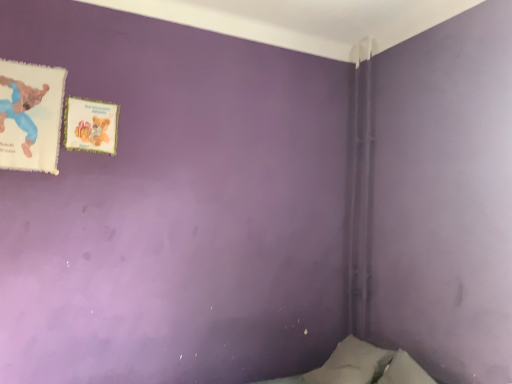
You are a GUI agent. You are given a task and a screenshot of the screen. Output one action in this format:
    pyautogui.click(x=<x>, y=<y>)
    Task: Click on the matte paper book at upper left, which appears as the first paperback book when viewed from the front
    This screenshot has height=384, width=512.
    Given the screenshot: What is the action you would take?
    pyautogui.click(x=30, y=116)

This screenshot has height=384, width=512. Describe the element at coordinates (30, 116) in the screenshot. I see `matte paper book at upper left, the 2th paperback book from the back` at that location.

What is the approximate width of matte paper book at upper left, marked as the second paperback book in a right-to-left arrangement?

1.09 inches.

Image resolution: width=512 pixels, height=384 pixels. What do you see at coordinates (90, 125) in the screenshot?
I see `matte paper book at upper left, which ranks as the 1th paperback book in right-to-left order` at bounding box center [90, 125].

This screenshot has height=384, width=512. I want to click on matte paper book at upper left, which appears as the 1th paperback book when viewed from the back, so click(x=90, y=125).

What is the approximate width of matte paper book at upper left, acting as the second paperback book starting from the left?

It is 0.63 inches.

Locate an element on the screen. The width and height of the screenshot is (512, 384). matte paper book at upper left, which is counted as the first paperback book, starting from the left is located at coordinates (30, 116).

Considering the positions of objects matte paper book at upper left, acting as the second paperback book starting from the left, and matte paper book at upper left, marked as the second paperback book in a right-to-left arrangement, in the image provided, who is more to the right, matte paper book at upper left, acting as the second paperback book starting from the left, or matte paper book at upper left, marked as the second paperback book in a right-to-left arrangement,?

matte paper book at upper left, acting as the second paperback book starting from the left.

Based on the photo, who is more distant, matte paper book at upper left, which appears as the 1th paperback book when viewed from the back, or matte paper book at upper left, which is counted as the first paperback book, starting from the left?

Positioned behind is matte paper book at upper left, which appears as the 1th paperback book when viewed from the back.

Is point (89, 144) positioned in front of point (64, 85)?

No, (89, 144) is further to viewer.

From the image's perspective, which object appears higher, matte paper book at upper left, acting as the second paperback book starting from the left, or matte paper book at upper left, the 2th paperback book from the back?

matte paper book at upper left, the 2th paperback book from the back, from the image's perspective.

From a real-world perspective, is matte paper book at upper left, the second paperback book from the front, physically located above or below matte paper book at upper left, the 2th paperback book from the back?

matte paper book at upper left, the second paperback book from the front, is above matte paper book at upper left, the 2th paperback book from the back.

In the scene shown: Which of these two, matte paper book at upper left, the second paperback book from the front, or matte paper book at upper left, which is counted as the first paperback book, starting from the left, is wider?

matte paper book at upper left, which is counted as the first paperback book, starting from the left.

Who is shorter, matte paper book at upper left, the second paperback book from the front, or matte paper book at upper left, the 2th paperback book from the back?

matte paper book at upper left, the second paperback book from the front.

Who is bigger, matte paper book at upper left, which appears as the 1th paperback book when viewed from the back, or matte paper book at upper left, the 2th paperback book from the back?

matte paper book at upper left, the 2th paperback book from the back, is bigger.

Could matte paper book at upper left, which appears as the first paperback book when viewed from the front, be considered to be inside matte paper book at upper left, acting as the second paperback book starting from the left?

No, matte paper book at upper left, acting as the second paperback book starting from the left, does not contain matte paper book at upper left, which appears as the first paperback book when viewed from the front.

Is matte paper book at upper left, acting as the second paperback book starting from the left, next to matte paper book at upper left, which is counted as the first paperback book, starting from the left?

No.

Is matte paper book at upper left, acting as the second paperback book starting from the left, positioned with its back to matte paper book at upper left, which appears as the first paperback book when viewed from the front?

That's not correct — matte paper book at upper left, acting as the second paperback book starting from the left, is not looking away from matte paper book at upper left, which appears as the first paperback book when viewed from the front.

How far apart are matte paper book at upper left, the second paperback book from the front, and matte paper book at upper left, which is counted as the first paperback book, starting from the left?

matte paper book at upper left, the second paperback book from the front, and matte paper book at upper left, which is counted as the first paperback book, starting from the left, are 6.82 inches apart.

Where is `paperback book below the matte paper book at upper left, which is counted as the first paperback book, starting from the left (from the image's perspective)`? The image size is (512, 384). paperback book below the matte paper book at upper left, which is counted as the first paperback book, starting from the left (from the image's perspective) is located at coordinates (90, 125).

Which is more to the right, matte paper book at upper left, the 2th paperback book from the back, or matte paper book at upper left, which ranks as the 1th paperback book in right-to-left order?

Positioned to the right is matte paper book at upper left, which ranks as the 1th paperback book in right-to-left order.

Which object is further away from the camera taking this photo, matte paper book at upper left, which is counted as the first paperback book, starting from the left, or matte paper book at upper left, which ranks as the 1th paperback book in right-to-left order?

matte paper book at upper left, which ranks as the 1th paperback book in right-to-left order, is more distant.

Considering the positions of point (11, 146) and point (101, 122), is point (11, 146) closer or farther from the camera than point (101, 122)?

Point (11, 146) is closer to the camera than point (101, 122).

From the image's perspective, is matte paper book at upper left, the 2th paperback book from the back, beneath matte paper book at upper left, the second paperback book from the front?

No, from the image's perspective, matte paper book at upper left, the 2th paperback book from the back, is not beneath matte paper book at upper left, the second paperback book from the front.

From a real-world perspective, between matte paper book at upper left, the 2th paperback book from the back, and matte paper book at upper left, the second paperback book from the front, who is vertically lower?

In real-world perspective, matte paper book at upper left, the 2th paperback book from the back, is lower.

Considering the sizes of objects matte paper book at upper left, which appears as the first paperback book when viewed from the front, and matte paper book at upper left, the second paperback book from the front, in the image provided, who is thinner, matte paper book at upper left, which appears as the first paperback book when viewed from the front, or matte paper book at upper left, the second paperback book from the front,?

With smaller width is matte paper book at upper left, the second paperback book from the front.

Considering the sizes of matte paper book at upper left, marked as the second paperback book in a right-to-left arrangement, and matte paper book at upper left, which ranks as the 1th paperback book in right-to-left order, in the image, is matte paper book at upper left, marked as the second paperback book in a right-to-left arrangement, taller or shorter than matte paper book at upper left, which ranks as the 1th paperback book in right-to-left order,?

matte paper book at upper left, marked as the second paperback book in a right-to-left arrangement, is taller than matte paper book at upper left, which ranks as the 1th paperback book in right-to-left order.

Based on the photo, which of these two, matte paper book at upper left, which is counted as the first paperback book, starting from the left, or matte paper book at upper left, which ranks as the 1th paperback book in right-to-left order, is smaller?

Smaller between the two is matte paper book at upper left, which ranks as the 1th paperback book in right-to-left order.

Is matte paper book at upper left, the 2th paperback book from the back, spatially inside matte paper book at upper left, which ranks as the 1th paperback book in right-to-left order, or outside of it?

matte paper book at upper left, the 2th paperback book from the back, is located beyond the bounds of matte paper book at upper left, which ranks as the 1th paperback book in right-to-left order.

Is matte paper book at upper left, marked as the second paperback book in a right-to-left arrangement, positioned far away from matte paper book at upper left, the second paperback book from the front?

They are positioned close to each other.

Is matte paper book at upper left, the 2th paperback book from the back, positioned with its back to matte paper book at upper left, which ranks as the 1th paperback book in right-to-left order?

No, matte paper book at upper left, which ranks as the 1th paperback book in right-to-left order, is not at the back of matte paper book at upper left, the 2th paperback book from the back.

Can you tell me how much matte paper book at upper left, which appears as the first paperback book when viewed from the front, and matte paper book at upper left, which appears as the 1th paperback book when viewed from the back, differ in facing direction?

There is a 0.191-degree angle between the facing directions of matte paper book at upper left, which appears as the first paperback book when viewed from the front, and matte paper book at upper left, which appears as the 1th paperback book when viewed from the back.

Locate an element on the screen. paperback book located below the matte paper book at upper left, which appears as the first paperback book when viewed from the front (from the image's perspective) is located at coordinates (90, 125).

You are a GUI agent. You are given a task and a screenshot of the screen. Output one action in this format:
    pyautogui.click(x=<x>, y=<y>)
    Task: Click on the paperback book in front of the matte paper book at upper left, which appears as the 1th paperback book when viewed from the back
    The height and width of the screenshot is (384, 512).
    Given the screenshot: What is the action you would take?
    pyautogui.click(x=30, y=116)

Identify the location of paperback book below the matte paper book at upper left, acting as the second paperback book starting from the left (from a real-world perspective). (30, 116).